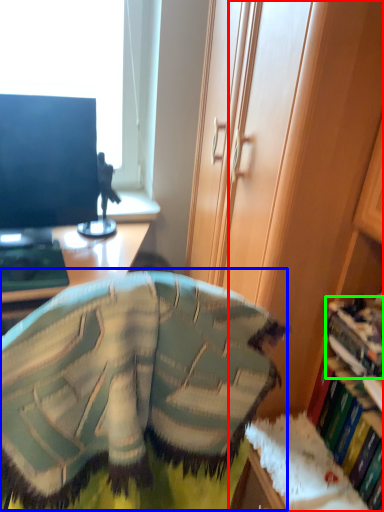
Question: Which is farther away from cabinetry (highlighted by a red box)? bean bag chair (highlighted by a blue box) or book (highlighted by a green box)?

Choices:
 (A) bean bag chair
 (B) book

Answer: (A)